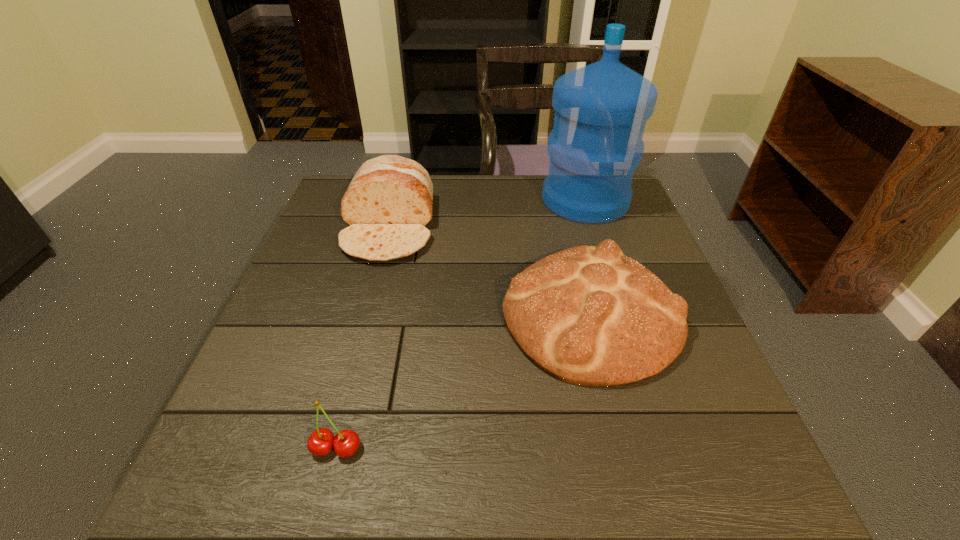
Identify the location of vacant area that satisfies the following two spatial constraints: 1. on the back side of the tallest object; 2. on the left side of the right bread. (561, 200).